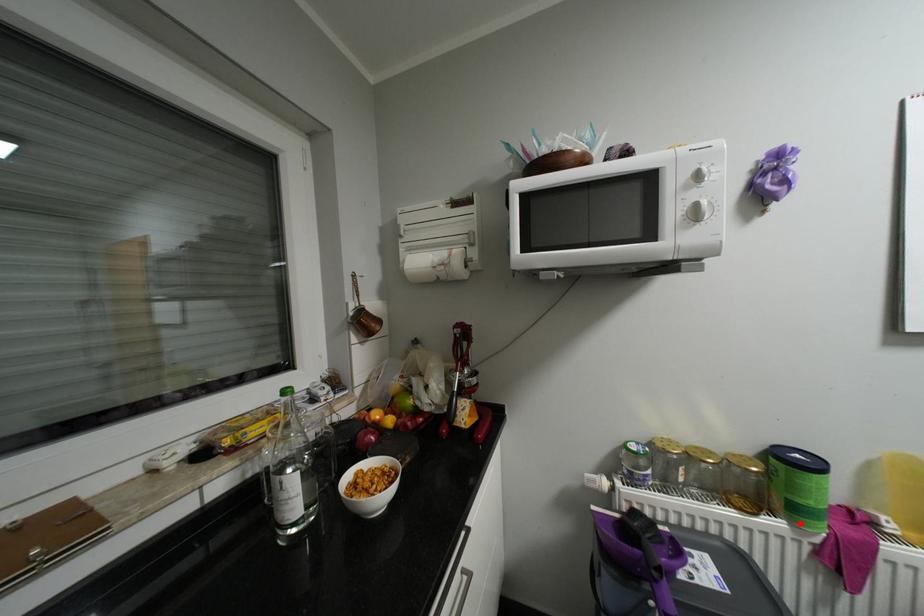
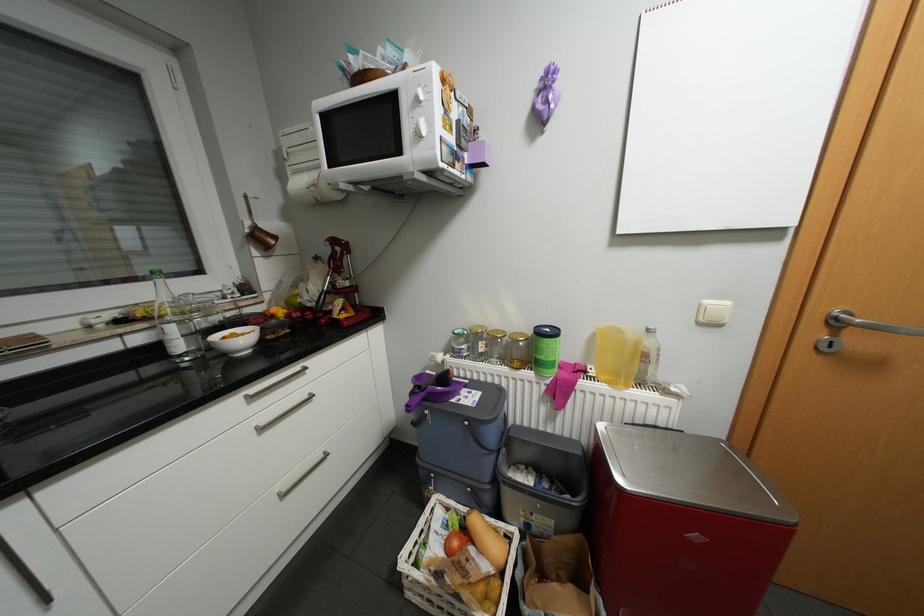
Question: A red point is marked in image1. In image2, is the corresponding 3D point closer to the camera or farther? Reply with the corresponding letter.

Choices:
 (A) The corresponding 3D point is closer.
 (B) The corresponding 3D point is farther.

Answer: (B)